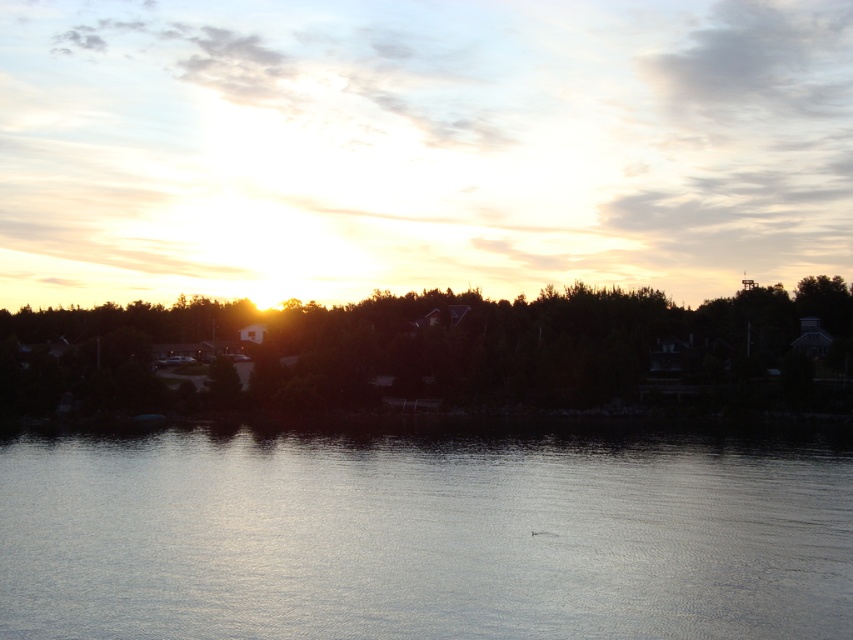
Question: Considering the relative positions of silvery reflective water at center and dark green leafy trees at center in the image provided, where is silvery reflective water at center located with respect to dark green leafy trees at center?

Choices:
 (A) below
 (B) above

Answer: (A)

Question: Can you confirm if silvery reflective water at center is wider than dark green leafy trees at center?

Choices:
 (A) no
 (B) yes

Answer: (A)

Question: Which point is farther to the camera?

Choices:
 (A) (0, 568)
 (B) (107, 378)

Answer: (B)

Question: Does silvery reflective water at center appear on the right side of dark green leafy trees at center?

Choices:
 (A) yes
 (B) no

Answer: (A)

Question: Which of the following is the closest to the observer?

Choices:
 (A) (751, 294)
 (B) (312, 540)

Answer: (B)